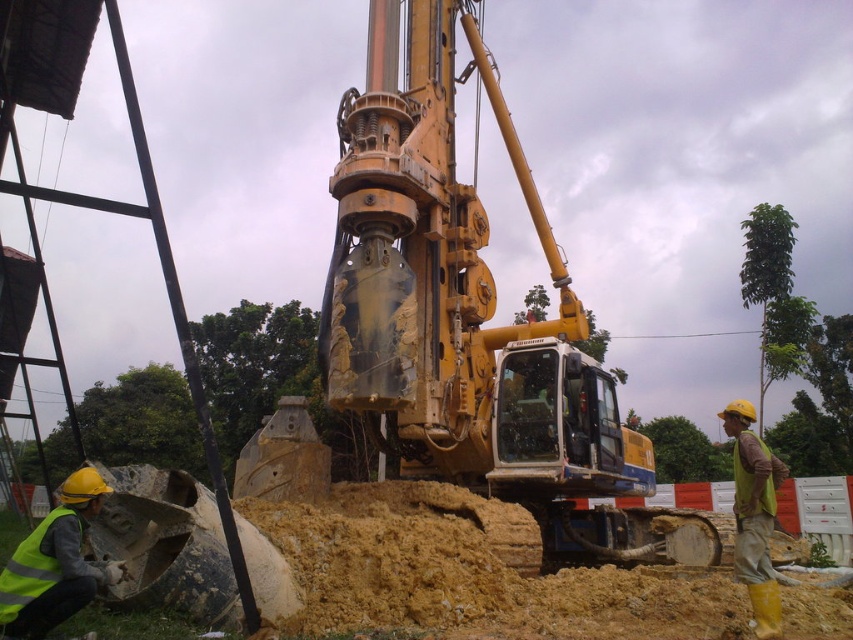
Question: Can you confirm if yellow metallic excavator at center is wider than yellow reflective vest at right?

Choices:
 (A) yes
 (B) no

Answer: (B)

Question: Which point is farther to the camera?

Choices:
 (A) (416, 88)
 (B) (770, 609)

Answer: (A)

Question: Among these points, which one is nearest to the camera?

Choices:
 (A) (54, 611)
 (B) (556, 484)
 (C) (737, 502)

Answer: (A)

Question: Does yellow metallic excavator at center appear on the right side of yellow reflective vest at right?

Choices:
 (A) yes
 (B) no

Answer: (B)

Question: Observing the image, what is the correct spatial positioning of yellow metallic excavator at center in reference to reflective yellow vest at lower left?

Choices:
 (A) right
 (B) left

Answer: (A)

Question: Which is farther from the yellow metallic excavator at center?

Choices:
 (A) reflective yellow vest at lower left
 (B) yellow reflective vest at right

Answer: (A)